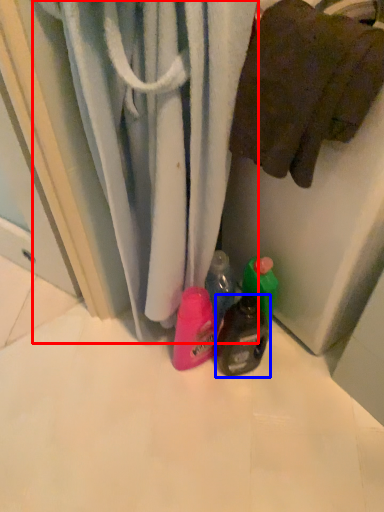
Question: Which of the following is the closest to the observer, curtain (highlighted by a red box) or bottle (highlighted by a blue box)?

Choices:
 (A) curtain
 (B) bottle

Answer: (A)